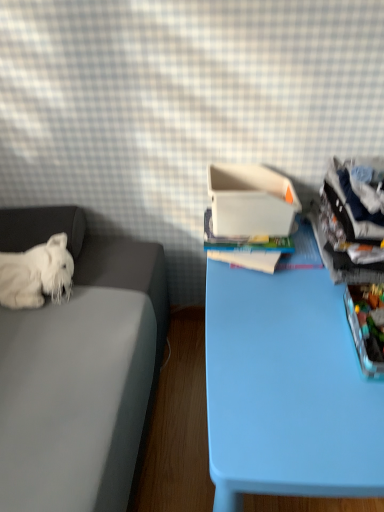
Where is `free space in front of white plastic container at center`? free space in front of white plastic container at center is located at coordinates (263, 292).